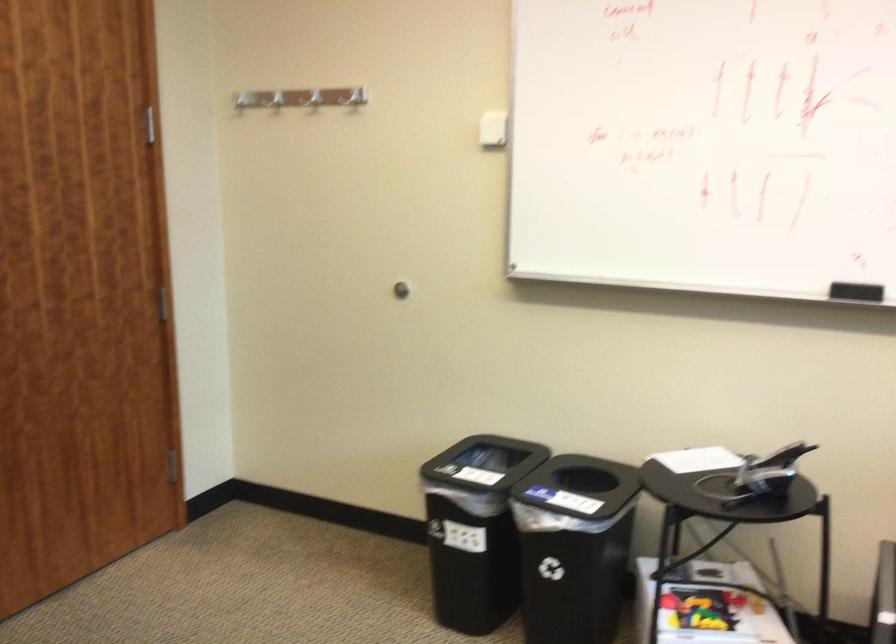
Which object does [701,609] point to?

This point indicates the colorful toy block.